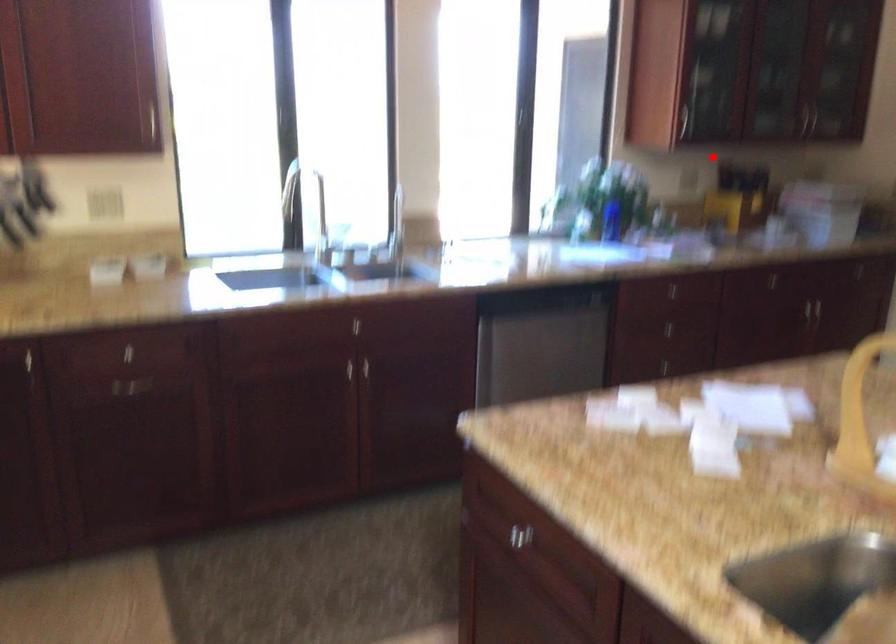
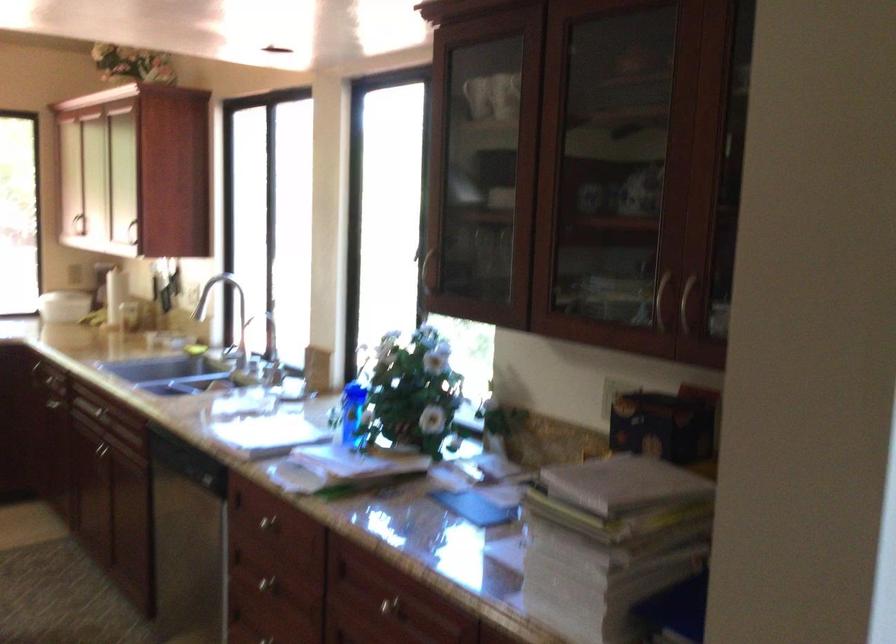
Question: I am providing you with two images of the same scene from different viewpoints. A red point is shown in image1. For the corresponding object point in image2, is it positioned nearer or farther from the camera?

Choices:
 (A) Nearer
 (B) Farther

Answer: (A)